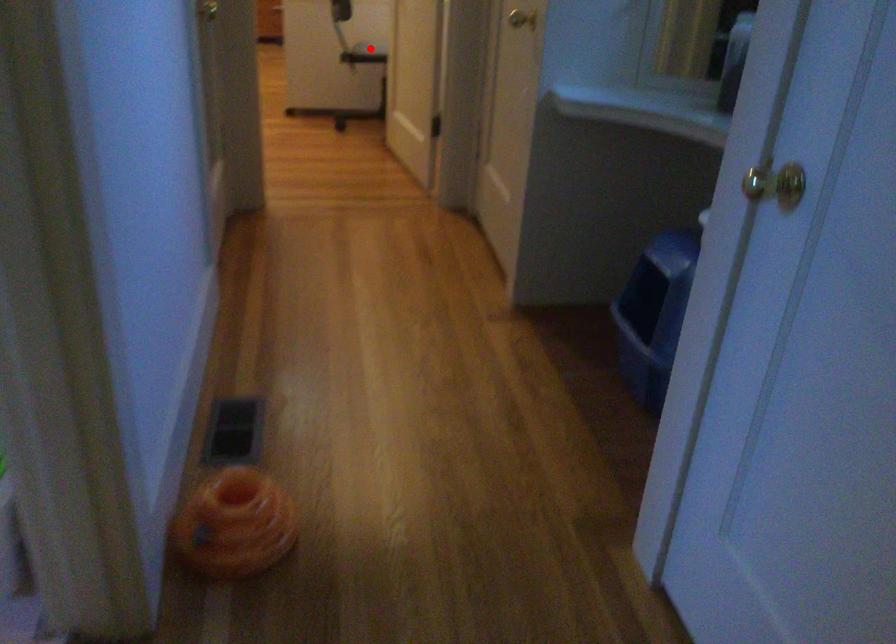
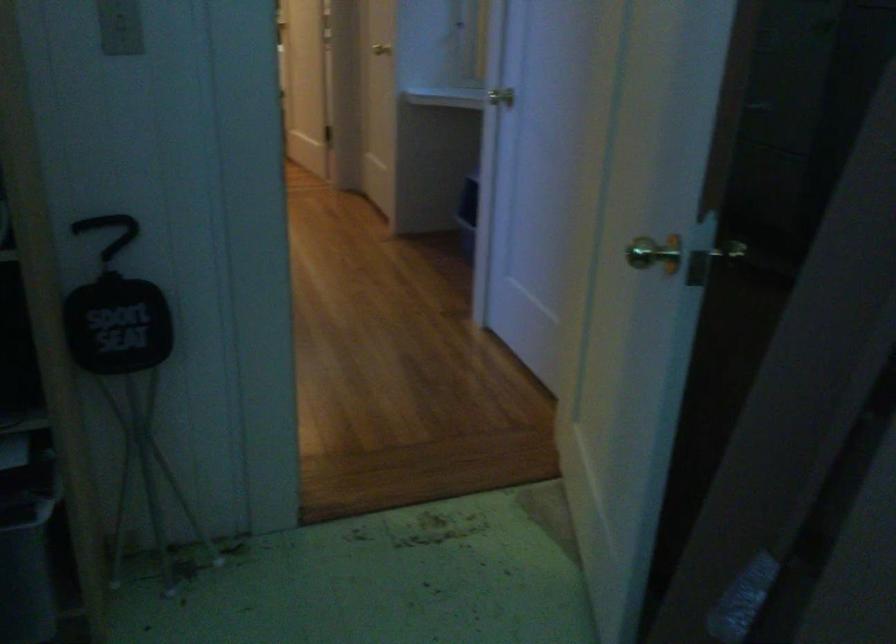
Question: I am providing you with two images of the same scene from different viewpoints. A red point is marked on the first image. Can you still see the location of the red point in image 2?

Choices:
 (A) Yes
 (B) No

Answer: (B)